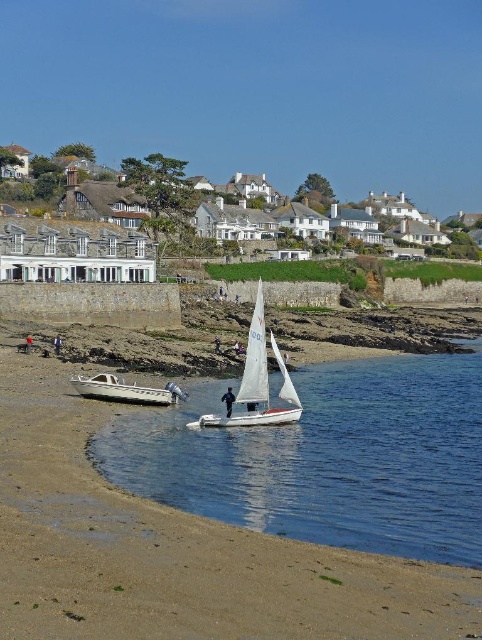
You are a photographer trying to capture a photo of both the dark blue fabric jacket at lower left and the dark blue fabric jacket at center. However, you notice that one jacket is blocking the view of the other. Which jacket is blocking the view of the other?

The dark blue fabric jacket at lower left is below the dark blue fabric jacket at center, so the jacket at center is blocking the view of the jacket at lower left.